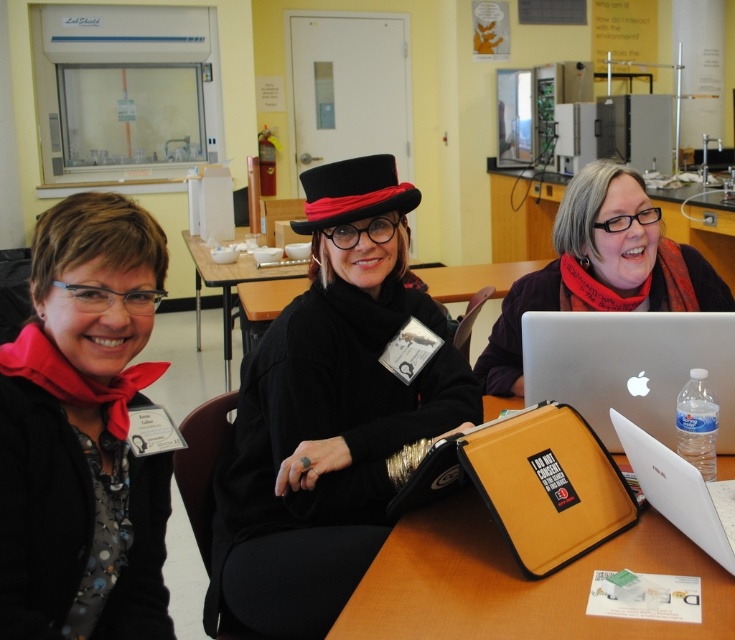
Is black matte hat at center behind white matte laptop at center?

Yes, it is behind white matte laptop at center.

Which is in front, point (397, 401) or point (684, 500)?

Point (684, 500) is in front.

Between point (344, 449) and point (681, 480), which one is positioned in front?

Point (681, 480) is more forward.

The height and width of the screenshot is (640, 735). Find the location of `black matte hat at center`. black matte hat at center is located at coordinates [x=329, y=413].

Does point (331, 172) come farther from viewer compared to point (245, 260)?

No, it is not.

Is point (331, 179) farther from camera compared to point (248, 272)?

No, it is not.

Where is `black felt hat at center`? The image size is (735, 640). black felt hat at center is located at coordinates (351, 193).

Between black matte hat at center and brown wooden table at center, which one has more height?

black matte hat at center is taller.

Based on the photo, who is more forward, (x=441, y=326) or (x=250, y=294)?

Point (x=441, y=326)

Locate an element on the screen. The height and width of the screenshot is (640, 735). black matte hat at center is located at coordinates (329, 413).